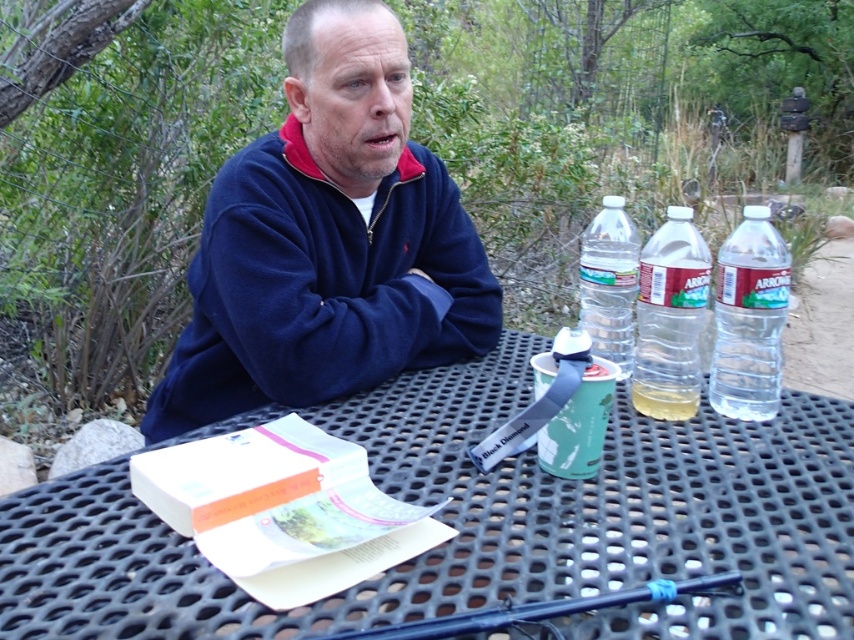
You are planning to place a new item on the table. The item is 10 cm wide. Can you fit it on the black metal table at center without overlapping the clear plastic bottle at right?

The black metal table at center is wider than the clear plastic bottle at right, so there is enough space to place the 10 cm wide item without overlapping the bottle.

You are a hiker who needs to carry both the clear plastic bottle at right and the translucent plastic cup at center. Which item can you fit more water into when filling them up?

The clear plastic bottle at right has a larger width than the translucent plastic cup at center, so it can hold more water.

You are a person sitting at the black metal table at center. You want to reach for the translucent plastic cup at center. Which direction should you move your hand to grab it?

The black metal table at center is to the left of the translucent plastic cup at center, so you should move your hand to the right to grab it.